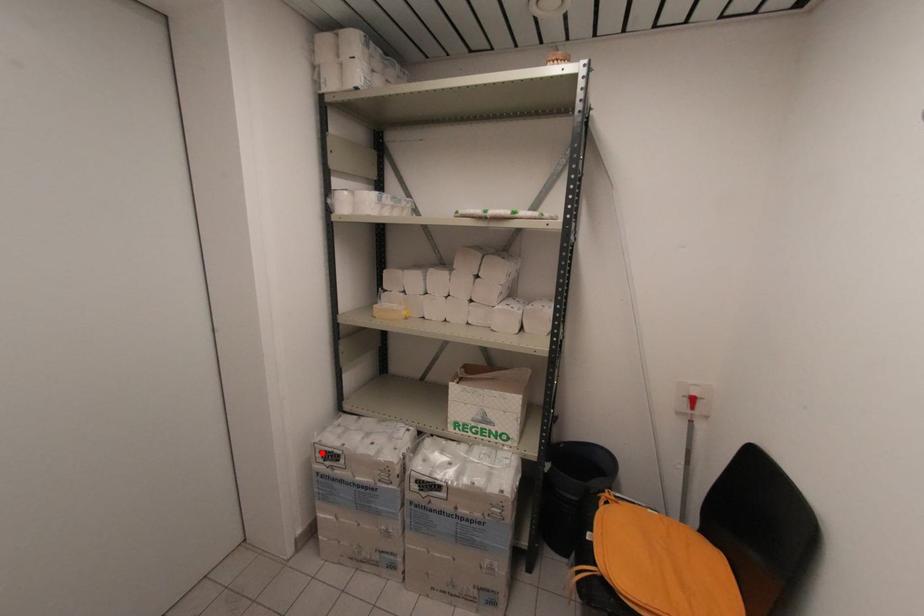
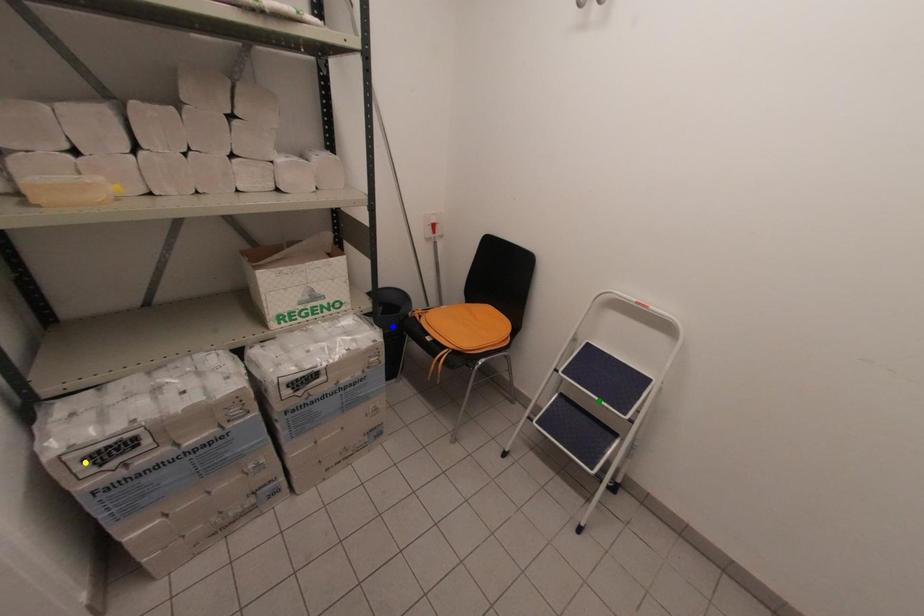
Question: I am providing you with two images of the same scene from different viewpoints. A red point is marked on the first image. You are given multiple points on the second image. Which spot in image 2 lines up with the point in image 1?

Choices:
 (A) yellow point
 (B) blue point
 (C) green point

Answer: (A)